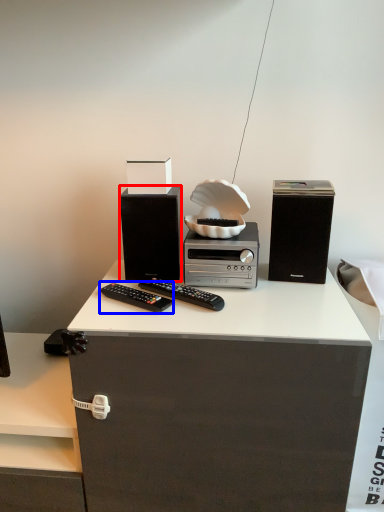
Question: Which point is further to the camera, speaker (highlighted by a red box) or remote control (highlighted by a blue box)?

Choices:
 (A) speaker
 (B) remote control

Answer: (A)